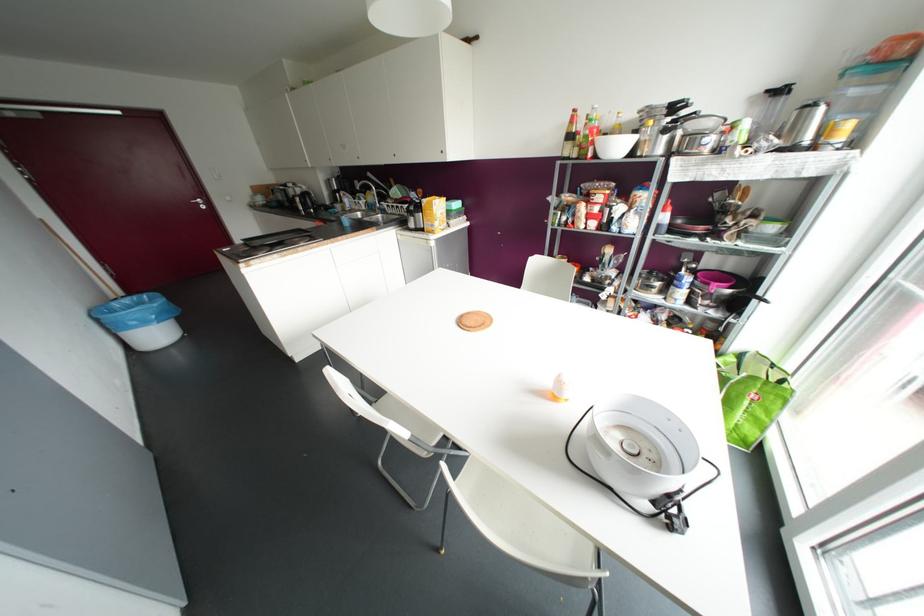
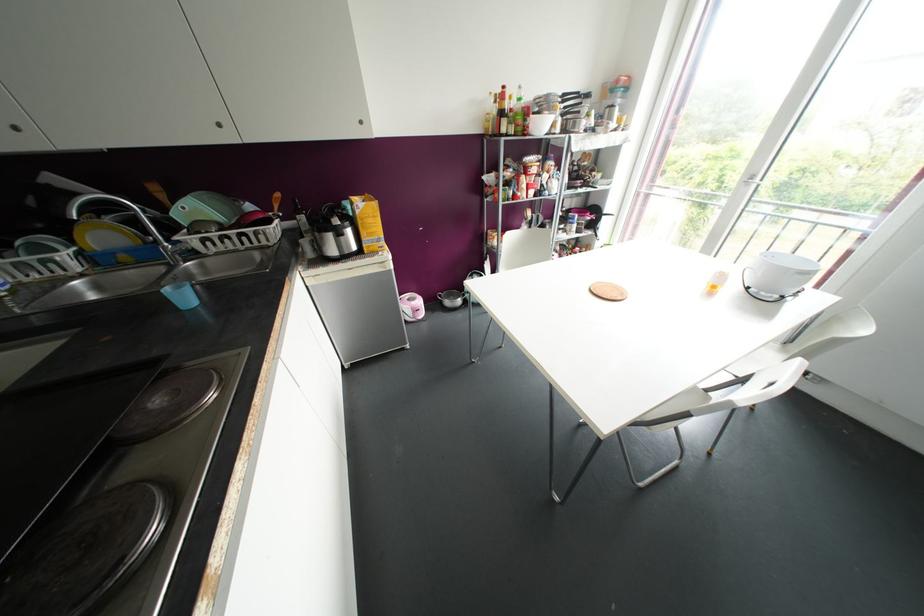
Question: I am providing you with two images of the same scene from different viewpoints. After the viewpoint changes to image2, which objects are now occluded?

Choices:
 (A) silver cabinet knob
 (B) small yellow bottle
 (C) green tote bag
 (D) black wall bowl

Answer: (C)